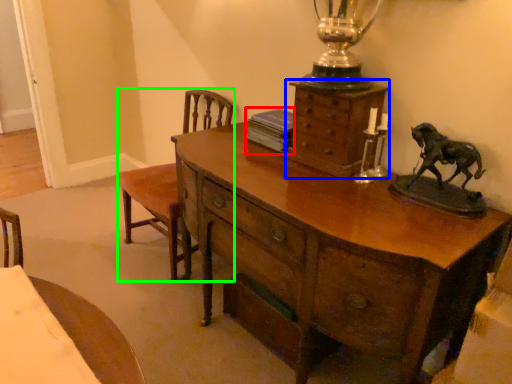
Question: Which object is positioned closest to book (highlighted by a red box)? Select from chest of drawers (highlighted by a blue box) and armchair (highlighted by a green box).

Choices:
 (A) chest of drawers
 (B) armchair

Answer: (A)